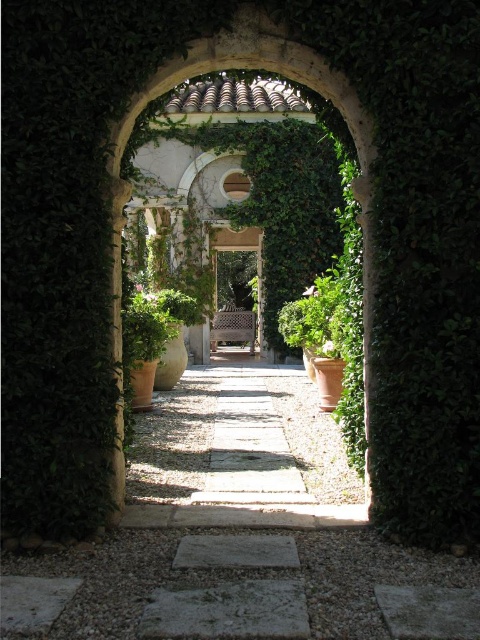
You are standing at the entrance of the garden and want to reach the wooden bench visible through the archway. Which direction should you walk relative to the smooth stone path at center?

The smooth stone path at center is located at point (250, 449), which is towards the lower right of the image. To reach the wooden bench through the archway, you should walk forward along the smooth stone path at center as it leads towards the garden area in the background.

You are standing at the entrance of the garden and see the smooth stone path at center and the wooden bench at center. Which object is positioned to the right of the other?

The smooth stone path at center is to the right of wooden bench at center.